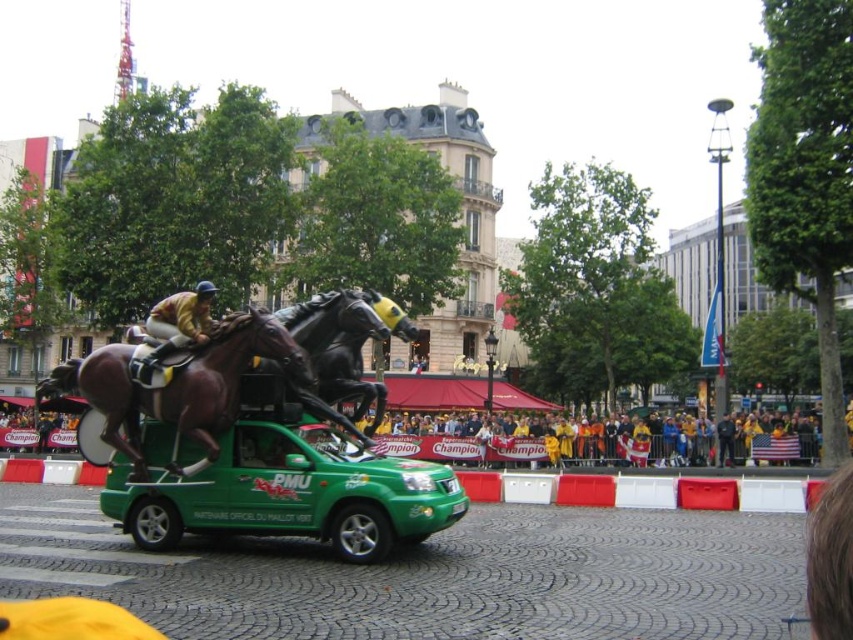
You are a child who wants to play with both the green plastic toy car at center and the shiny brown horse at center. If you first pick up the object on the left, which one will you hold?

The shiny brown horse at center is on the left side of the green plastic toy car at center, so you will hold the shiny brown horse at center first.

Consider the image. You are a photographer trying to capture the festive street scene. You notice the shiny brown horse at center and the yellow fabric at lower center. Which object should you focus on to ensure it fills more of your camera frame?

The shiny brown horse at center is bigger than the yellow fabric at lower center, so focusing on the shiny brown horse at center will fill more of the camera frame.

You are a child who wants to play with both the green plastic toy car at center and the shiny brown horse at center. If you place them side by side, which one will take up more space horizontally?

The shiny brown horse at center will take up more space horizontally because it has a greater width than the green plastic toy car at center.